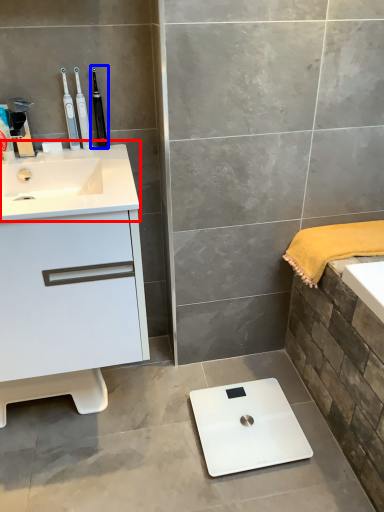
Question: Among these objects, which one is farthest to the camera, sink (highlighted by a red box) or toothbrush (highlighted by a blue box)?

Choices:
 (A) sink
 (B) toothbrush

Answer: (B)